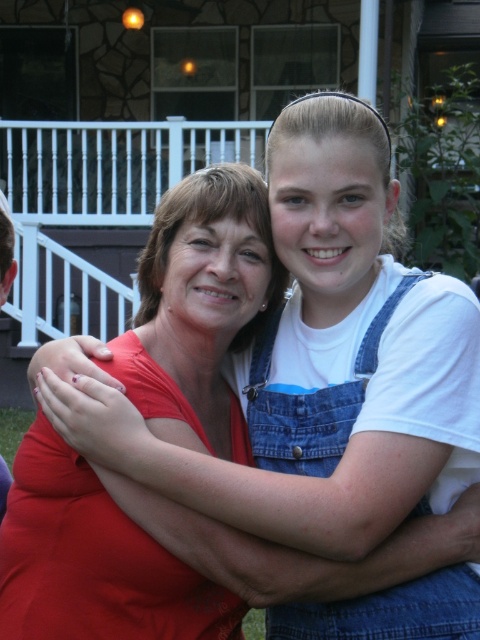
You are standing in the same location as the two people in the image. If you want to reach both point A at coordinates point [240,298] and point B at coordinates point [453,627], which point would you need to walk towards first to get closer to both?

You should walk towards point A at coordinates point [240,298] first because it is closer to you than point B at coordinates point [453,627]. Moving towards point A first will reduce the distance to both points more effectively.

You are standing in the same location as the photographer who took this photo. You want to hand a gift to the person wearing the matte red shirt at center without moving from your current position. Is it possible to reach them from where you are standing?

The distance between the matte red shirt at center and the viewer is 8.15 feet. Since the average human arm length is about 2.5 feet, you cannot reach the person wearing the matte red shirt at center from your current position without moving.